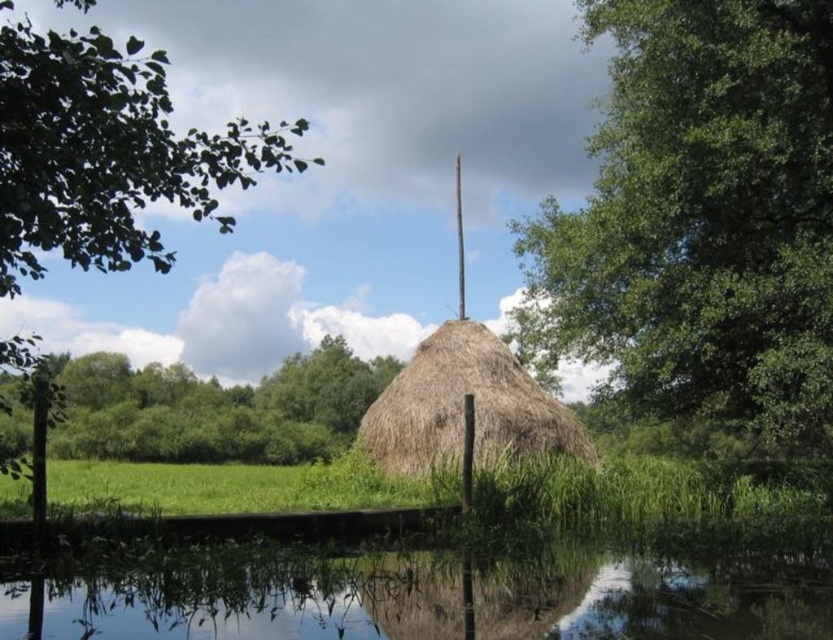
You are a hiker who wants to take a photo of the green leafy tree at upper left and the green grassy field at center. Which object should you focus on first if you want to capture both in a single frame without moving your camera?

The green leafy tree at upper left is larger in size compared to the green grassy field at center, so you should focus on the green leafy tree at upper left first to ensure it fits properly in the frame.

You are planning to take a photo of the green leafy tree at upper left and the green grassy field at center from a position where both are visible. Which object will appear smaller in the photo?

The green leafy tree at upper left will appear smaller in the photo because it has a lesser width compared to the green grassy field at center.

You are standing in front of the thatched structure and want to know which object is taller between the transparent water at lower center and the green leafy tree at upper left. Can you determine this based on the scene?

The transparent water at lower center has a lesser height compared to green leafy tree at upper left, so the green leafy tree at upper left is taller.